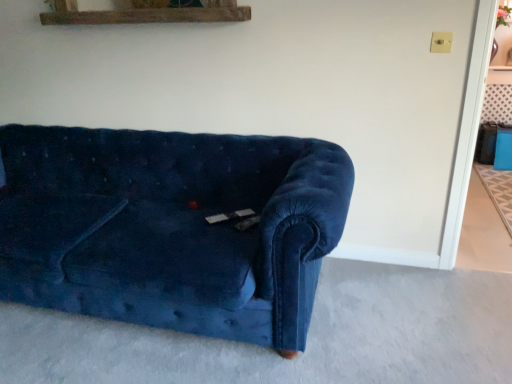
What do you see at coordinates (170, 227) in the screenshot? The image size is (512, 384). I see `velvet blue couch at center` at bounding box center [170, 227].

What do you see at coordinates (307, 339) in the screenshot?
I see `velvet couch at lower left, the first concrete from the bottom` at bounding box center [307, 339].

Where is `velvet blue couch at center`? This screenshot has height=384, width=512. velvet blue couch at center is located at coordinates (170, 227).

Which object is positioned more to the left, velvet blue couch at center or beige carpet at lower right, which appears as the second concrete when viewed from the left?

Positioned to the left is velvet blue couch at center.

Relative to beige carpet at lower right, which appears as the second concrete when viewed from the left, is velvet blue couch at center in front or behind?

In the image, velvet blue couch at center appears in front of beige carpet at lower right, which appears as the second concrete when viewed from the left.

Locate an element on the screen. The width and height of the screenshot is (512, 384). studio couch in front of the beige carpet at lower right, placed as the second concrete when sorted from front to back is located at coordinates (170, 227).

In terms of height, does velvet blue couch at center look taller or shorter compared to beige carpet at lower right, which appears as the first concrete when viewed from the top?

velvet blue couch at center is taller than beige carpet at lower right, which appears as the first concrete when viewed from the top.

From the image's perspective, which one is positioned higher, velvet blue couch at center or velvet couch at lower left, the 2th concrete when ordered from top to bottom?

velvet blue couch at center is shown above in the image.

Looking at this image, is velvet couch at lower left, the first concrete from the bottom, at the back of velvet blue couch at center?

No, velvet blue couch at center is not facing the opposite direction of velvet couch at lower left, the first concrete from the bottom.

Is velvet blue couch at center located outside velvet couch at lower left, which is counted as the first concrete, starting from the front?

velvet blue couch at center is positioned outside velvet couch at lower left, which is counted as the first concrete, starting from the front.

Is beige carpet at lower right, the first concrete in the back-to-front sequence, touching velvet couch at lower left, the 2th concrete when ordered from top to bottom?

No, beige carpet at lower right, the first concrete in the back-to-front sequence, is not beside velvet couch at lower left, the 2th concrete when ordered from top to bottom.

Who is smaller, beige carpet at lower right, placed as the second concrete when sorted from front to back, or velvet couch at lower left, the first concrete from the bottom?

beige carpet at lower right, placed as the second concrete when sorted from front to back.

Where is `concrete that appears below the beige carpet at lower right, which appears as the first concrete when viewed from the top (from the image's perspective)`? The width and height of the screenshot is (512, 384). concrete that appears below the beige carpet at lower right, which appears as the first concrete when viewed from the top (from the image's perspective) is located at coordinates (307, 339).

From a real-world perspective, who is located lower, beige carpet at lower right, which appears as the first concrete when viewed from the top, or velvet couch at lower left, the 2th concrete positioned from the back?

velvet couch at lower left, the 2th concrete positioned from the back, from a real-world perspective.

From a real-world perspective, which object rests below the other?

velvet couch at lower left, the 2th concrete when ordered from top to bottom, is physically lower.

In the scene shown: From the image's perspective, between velvet couch at lower left, the 2th concrete positioned from the right, and beige carpet at lower right, the first concrete in the back-to-front sequence, who is located below?

velvet couch at lower left, the 2th concrete positioned from the right, appears lower in the image.

Considering the relative sizes of velvet couch at lower left, the 2th concrete positioned from the back, and beige carpet at lower right, the first concrete in the back-to-front sequence, in the image provided, is velvet couch at lower left, the 2th concrete positioned from the back, thinner than beige carpet at lower right, the first concrete in the back-to-front sequence,?

Incorrect, the width of velvet couch at lower left, the 2th concrete positioned from the back, is not less than that of beige carpet at lower right, the first concrete in the back-to-front sequence.

Considering the relative sizes of velvet couch at lower left, the 2th concrete when ordered from top to bottom, and velvet blue couch at center in the image provided, is velvet couch at lower left, the 2th concrete when ordered from top to bottom, shorter than velvet blue couch at center?

Indeed, velvet couch at lower left, the 2th concrete when ordered from top to bottom, has a lesser height compared to velvet blue couch at center.

Is velvet couch at lower left, the 2th concrete positioned from the right, far away from velvet blue couch at center?

No, there isn't a large distance between velvet couch at lower left, the 2th concrete positioned from the right, and velvet blue couch at center.

Is point (258, 359) more distant than point (130, 307)?

No, (258, 359) is in front of (130, 307).

Which of these two, velvet couch at lower left, the 2th concrete positioned from the back, or velvet blue couch at center, is bigger?

With larger size is velvet blue couch at center.

Is beige carpet at lower right, which is counted as the 2th concrete, starting from the bottom, not near velvet blue couch at center?

Indeed, beige carpet at lower right, which is counted as the 2th concrete, starting from the bottom, is not near velvet blue couch at center.

Does point (490, 203) lie behind point (245, 285)?

That is True.

What's the angular difference between beige carpet at lower right, placed as the second concrete when sorted from front to back, and velvet blue couch at center's facing directions?

The angular difference between beige carpet at lower right, placed as the second concrete when sorted from front to back, and velvet blue couch at center is 90.2 degrees.

Locate an element on the screen. The width and height of the screenshot is (512, 384). concrete above the velvet blue couch at center (from the image's perspective) is located at coordinates (483, 233).

Starting from the velvet blue couch at center, which concrete is the 2nd one to the right? Please provide its 2D coordinates.

[(483, 233)]

Locate an element on the screen. concrete below the velvet blue couch at center (from the image's perspective) is located at coordinates tap(307, 339).

From the picture: Which object lies nearer to the anchor point beige carpet at lower right, the 1th concrete when ordered from right to left, velvet couch at lower left, which is counted as the first concrete, starting from the front, or velvet blue couch at center?

Based on the image, velvet couch at lower left, which is counted as the first concrete, starting from the front, appears to be nearer to beige carpet at lower right, the 1th concrete when ordered from right to left.

When comparing their distances from beige carpet at lower right, placed as the second concrete when sorted from front to back, does velvet blue couch at center or velvet couch at lower left, the 2th concrete positioned from the back, seem further?

Among the two, velvet blue couch at center is located further to beige carpet at lower right, placed as the second concrete when sorted from front to back.

When comparing their distances from velvet blue couch at center, does beige carpet at lower right, which is counted as the 2th concrete, starting from the bottom, or velvet couch at lower left, the 2th concrete when ordered from top to bottom, seem further?

The object further to velvet blue couch at center is beige carpet at lower right, which is counted as the 2th concrete, starting from the bottom.

When comparing their distances from velvet blue couch at center, does velvet couch at lower left, the 2th concrete positioned from the back, or beige carpet at lower right, which is counted as the 2th concrete, starting from the bottom, seem closer?

The object closer to velvet blue couch at center is velvet couch at lower left, the 2th concrete positioned from the back.

From the image, which object appears to be nearer to velvet couch at lower left, the 2th concrete positioned from the back, velvet blue couch at center or beige carpet at lower right, placed as the second concrete when sorted from front to back?

Based on the image, velvet blue couch at center appears to be nearer to velvet couch at lower left, the 2th concrete positioned from the back.

Consider the image. Which object lies nearer to the anchor point velvet couch at lower left, marked as the 1th concrete in a left-to-right arrangement, beige carpet at lower right, the first concrete in the back-to-front sequence, or velvet blue couch at center?

velvet blue couch at center.

At what (x,y) coordinates should I click in order to perform the action: click on concrete situated between velvet blue couch at center and beige carpet at lower right, which appears as the second concrete when viewed from the left, from left to right. Please return your answer as a coordinate pair (x, y). This screenshot has width=512, height=384. Looking at the image, I should click on (307, 339).